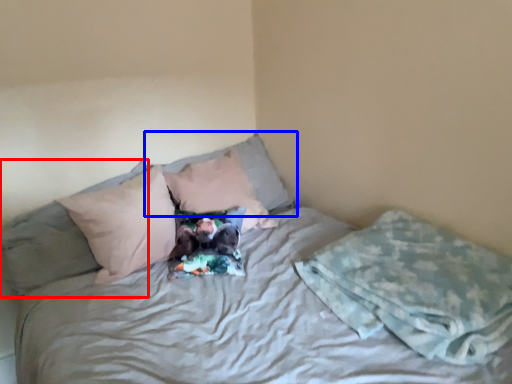
Question: Which point is further to the camera, pillow (highlighted by a red box) or pillow (highlighted by a blue box)?

Choices:
 (A) pillow
 (B) pillow

Answer: (B)